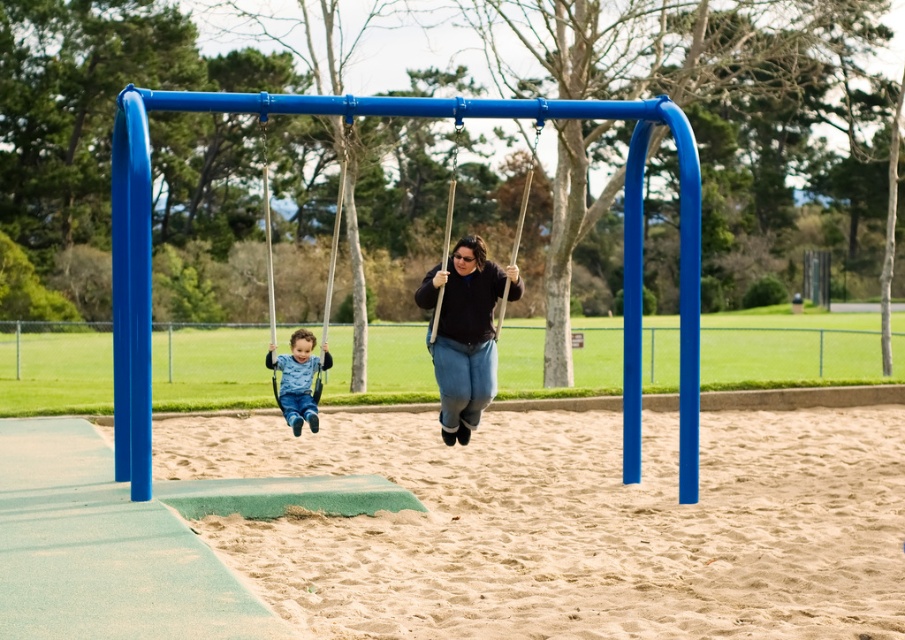
Question: Is beige sandy ground at lower center to the right of matte black sweater at center from the viewer's perspective?

Choices:
 (A) no
 (B) yes

Answer: (B)

Question: Among these objects, which one is nearest to the camera?

Choices:
 (A) matte blue swing at left
 (B) matte black sweater at center

Answer: (A)

Question: Is matte blue shirt at center further to camera compared to matte black swing at center?

Choices:
 (A) no
 (B) yes

Answer: (B)

Question: Among these points, which one is nearest to the camera?

Choices:
 (A) (368, 616)
 (B) (311, 419)
 (C) (532, 161)

Answer: (A)

Question: Which point is farther from the camera taking this photo?

Choices:
 (A) (283, 403)
 (B) (481, 301)

Answer: (A)

Question: Does matte black sweater at center appear under matte black swing at center?

Choices:
 (A) yes
 (B) no

Answer: (A)